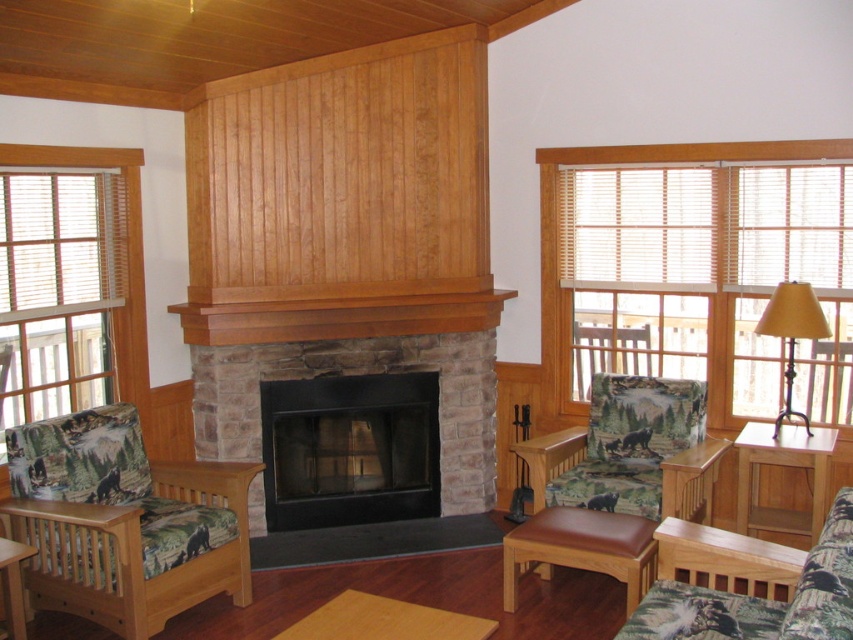
You are sitting on the brown leather stool at center and want to reach the printed fabric armchair at left. Is the armchair above or below your current position?

The printed fabric armchair at left is located above the brown leather stool at center, so it is above your current position.